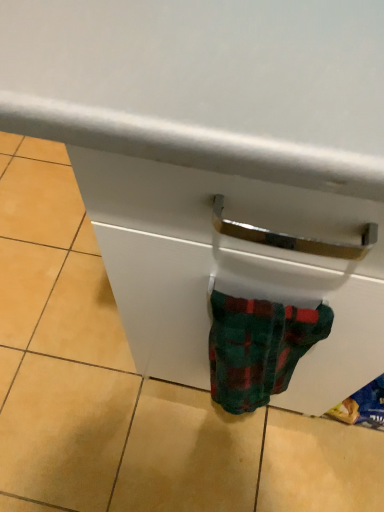
Question: In terms of width, does white glossy drawer at center look wider or thinner when compared to fluffy plaid sock at lower right?

Choices:
 (A) thin
 (B) wide

Answer: (B)

Question: Does point (180, 322) appear closer or farther from the camera than point (288, 305)?

Choices:
 (A) closer
 (B) farther

Answer: (B)

Question: In the image, is white glossy drawer at center on the left side or the right side of fluffy plaid sock at lower right?

Choices:
 (A) right
 (B) left

Answer: (B)

Question: Is fluffy plaid sock at lower right inside the boundaries of white glossy drawer at center, or outside?

Choices:
 (A) inside
 (B) outside

Answer: (B)

Question: Is fluffy plaid sock at lower right wider or thinner than white glossy drawer at center?

Choices:
 (A) wide
 (B) thin

Answer: (B)

Question: From the image's perspective, is fluffy plaid sock at lower right positioned above or below white glossy drawer at center?

Choices:
 (A) above
 (B) below

Answer: (B)

Question: Based on their sizes in the image, would you say fluffy plaid sock at lower right is bigger or smaller than white glossy drawer at center?

Choices:
 (A) big
 (B) small

Answer: (B)